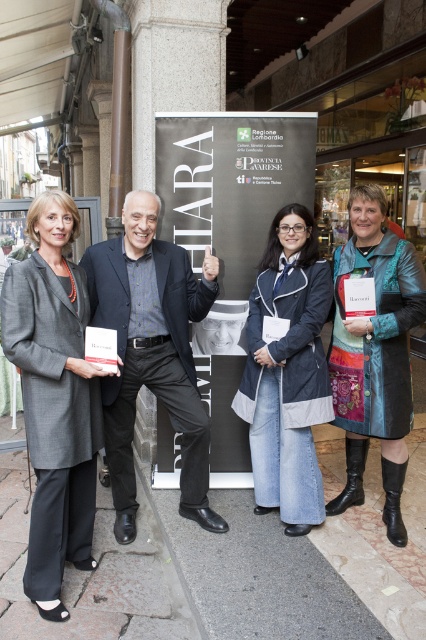
Question: Based on their relative distances, which object is nearer to the denim jacket at center?

Choices:
 (A) white paper at center
 (B) matte gray coat at center

Answer: (A)

Question: Observing the image, what is the correct spatial positioning of white paper at center in reference to dark gray suit at center?

Choices:
 (A) below
 (B) above

Answer: (B)

Question: Which object appears closest to the camera in this image?

Choices:
 (A) leather jacket at center
 (B) denim jacket at center
 (C) dark gray suit at center

Answer: (A)

Question: Is matte gray coat at center smaller than leather jacket at center?

Choices:
 (A) no
 (B) yes

Answer: (A)

Question: Where is matte gray coat at center located in relation to dark gray suit at center in the image?

Choices:
 (A) below
 (B) above

Answer: (A)

Question: Which of the following is the closest to the observer?

Choices:
 (A) matte gray coat at center
 (B) denim jacket at center
 (C) white paper at center

Answer: (A)